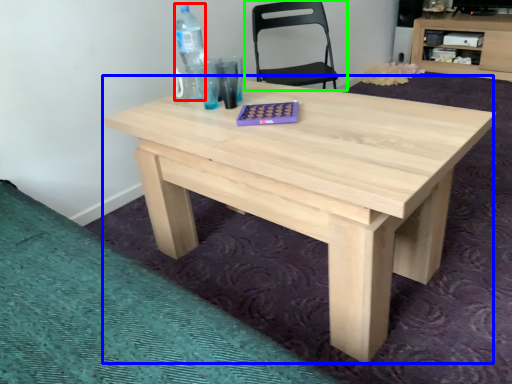
Question: Based on their relative distances, which object is nearer to bottle (highlighted by a red box)? Choose from table (highlighted by a blue box) and chair (highlighted by a green box).

Choices:
 (A) table
 (B) chair

Answer: (A)